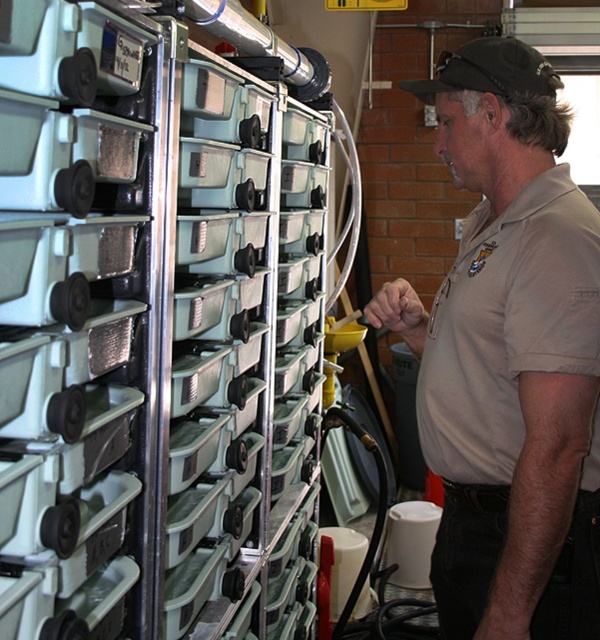
Question: Does beige uniform at center have a lesser width compared to black fabric baseball cap at upper center?

Choices:
 (A) no
 (B) yes

Answer: (A)

Question: Among these points, which one is nearest to the camera?

Choices:
 (A) (274, 109)
 (B) (543, 308)

Answer: (B)

Question: Based on their relative distances, which object is farther from the beige uniform at center?

Choices:
 (A) matte plastic drawers at center
 (B) black fabric baseball cap at upper center

Answer: (A)

Question: Does matte plastic drawers at center have a larger size compared to black fabric baseball cap at upper center?

Choices:
 (A) yes
 (B) no

Answer: (A)

Question: Can you confirm if matte plastic drawers at center is smaller than black fabric baseball cap at upper center?

Choices:
 (A) yes
 (B) no

Answer: (B)

Question: Which of the following is the farthest from the observer?

Choices:
 (A) (457, 604)
 (B) (490, 61)
 (C) (145, 465)

Answer: (A)